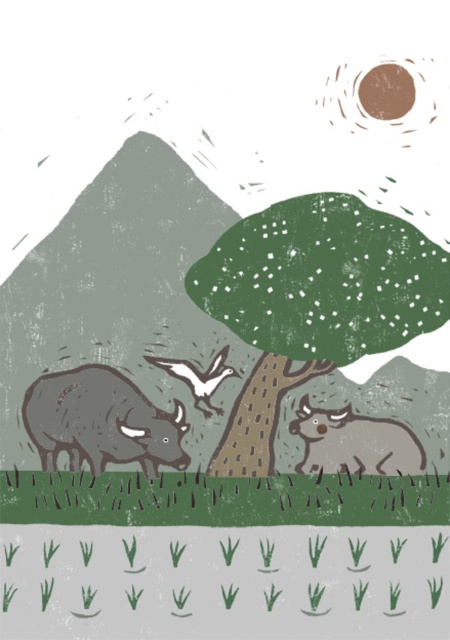
Looking at this image, you are a farmer measuring the distance between the two gray textured cows in the field. The minimum safe distance for grazing cows is 6 inches. Based on the scene, is the distance between the gray textured cow at center and the gray textured cow at lower right sufficient to meet the safety requirement?

The gray textured cow at center and gray textured cow at lower right are 5.92 inches apart, which is slightly less than the required 6 inches for the minimum safe distance. Therefore, the distance does not meet the safety requirement.

You are standing at the point marked as point (221, 499) in the image. What do you see directly in front of you?

You see green textured grass at lower center directly in front of you at point (221, 499).

You are standing in a field and see the green textured grass at lower center and the green textured tree at center. Which one is nearer to you?

The green textured grass at lower center is closer to the viewer than the green textured tree at center.